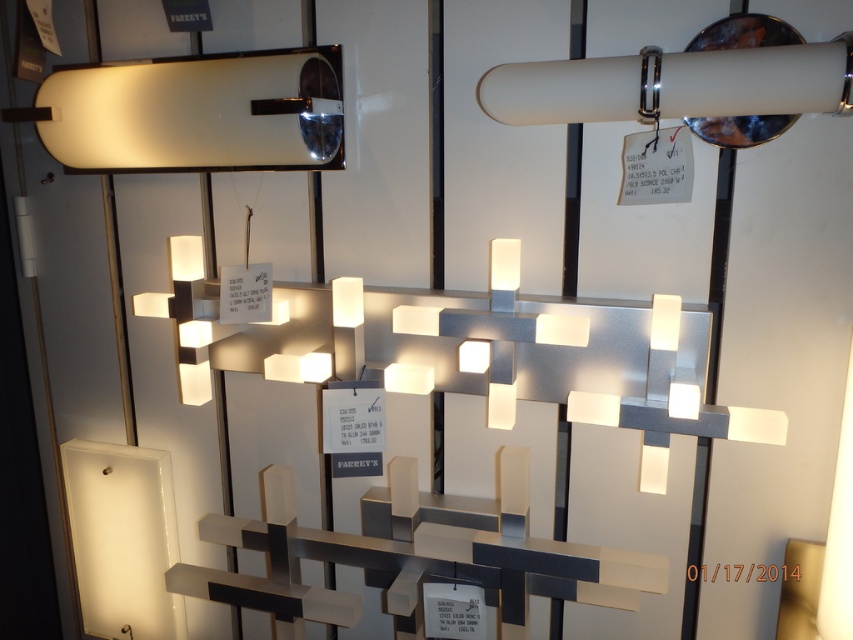
Question: Which point is closer to the camera?

Choices:
 (A) satin white glass at upper left
 (B) satin white tube at upper right

Answer: (B)

Question: Can you confirm if satin white glass at upper left is wider than satin white tube at upper right?

Choices:
 (A) no
 (B) yes

Answer: (B)

Question: Can you confirm if satin white glass at upper left is thinner than satin white tube at upper right?

Choices:
 (A) yes
 (B) no

Answer: (B)

Question: Can you confirm if satin white glass at upper left is thinner than satin white tube at upper right?

Choices:
 (A) no
 (B) yes

Answer: (A)